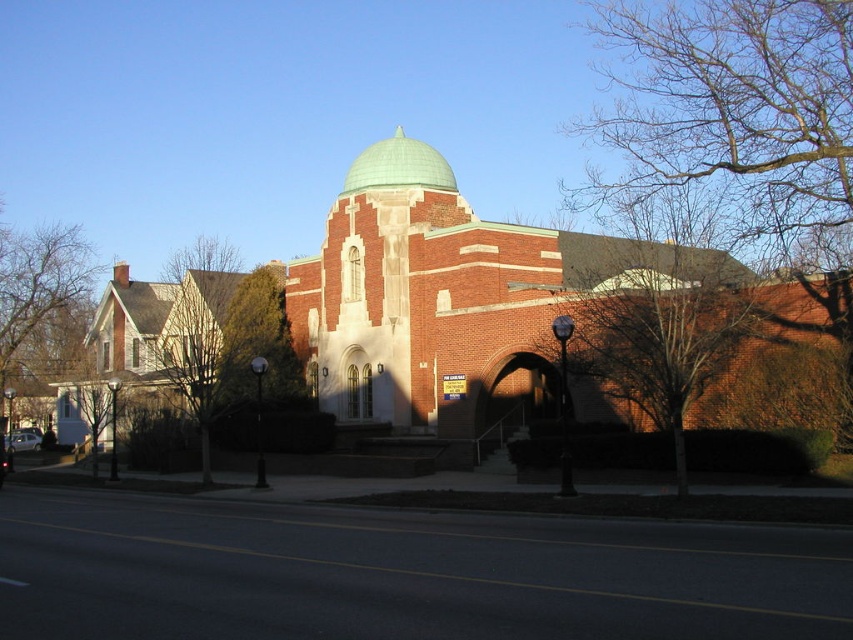
Who is taller, brown leafless tree at left or green matte dome at center?

green matte dome at center

Which is below, brown leafless tree at left or green matte dome at center?

Positioned lower is brown leafless tree at left.

Is point (57, 344) in front of point (415, 154)?

That is False.

Find the location of a particular element. brown leafless tree at left is located at coordinates (41, 300).

Who is more distant from viewer, (625, 173) or (360, 184)?

The point (625, 173) is more distant.

Can you confirm if bare branches at upper right is positioned below green matte dome at center?

Yes.

At what (x,y) coordinates should I click in order to perform the action: click on bare branches at upper right. Please return your answer as a coordinate pair (x, y). Image resolution: width=853 pixels, height=640 pixels. Looking at the image, I should click on (740, 129).

Who is lower down, bare branches at upper right or brown leafless tree at left?

brown leafless tree at left is lower down.

Which is above, bare branches at upper right or brown leafless tree at left?

Positioned higher is bare branches at upper right.

You are a GUI agent. You are given a task and a screenshot of the screen. Output one action in this format:
    pyautogui.click(x=<x>, y=<y>)
    Task: Click on the bare branches at upper right
    This screenshot has height=640, width=853.
    Given the screenshot: What is the action you would take?
    pyautogui.click(x=740, y=129)